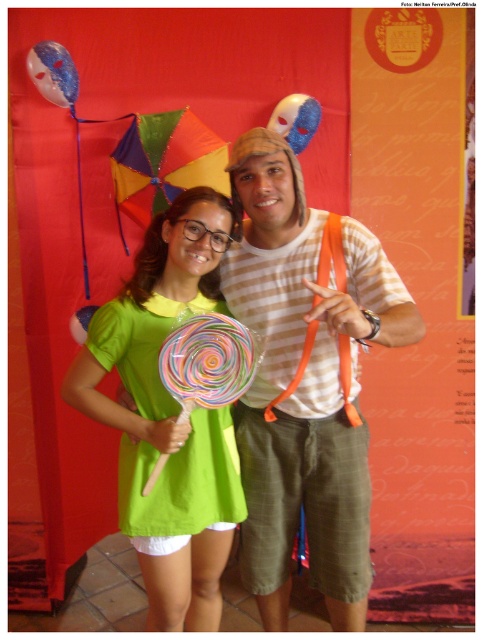
Question: Which of the following is the closest to the observer?

Choices:
 (A) green matte dress at center
 (B) striped cotton shirt at center

Answer: (B)

Question: Can you confirm if striped cotton shirt at center is positioned to the right of green matte dress at center?

Choices:
 (A) yes
 (B) no

Answer: (A)

Question: Is striped cotton shirt at center bigger than green matte dress at center?

Choices:
 (A) no
 (B) yes

Answer: (B)

Question: Which point appears farthest from the camera in this image?

Choices:
 (A) (339, 538)
 (B) (227, 412)

Answer: (B)

Question: Which point is closer to the camera?

Choices:
 (A) striped cotton shirt at center
 (B) green matte dress at center

Answer: (A)

Question: Can you confirm if striped cotton shirt at center is wider than green matte dress at center?

Choices:
 (A) yes
 (B) no

Answer: (A)